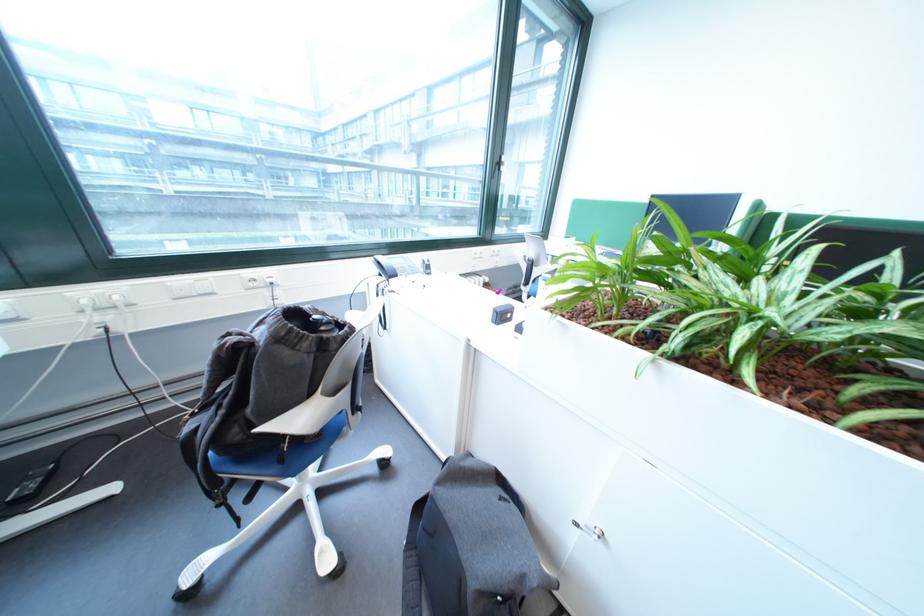
Where is `silver cabinet handle`? This screenshot has width=924, height=616. silver cabinet handle is located at coordinates (589, 530).